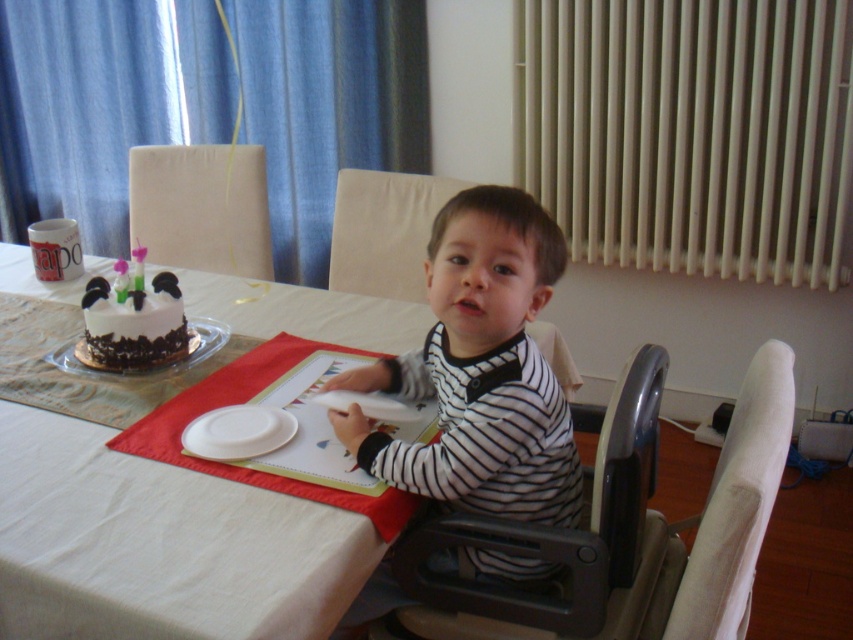
In the scene shown: Between striped fabric shirt at center and white chocolate cake at left, which one has less height?

white chocolate cake at left is shorter.

Can you confirm if striped fabric shirt at center is smaller than white chocolate cake at left?

No, striped fabric shirt at center is not smaller than white chocolate cake at left.

Where is `striped fabric shirt at center`? striped fabric shirt at center is located at coordinates (479, 371).

Is beige fabric chair at upper left shorter than white frosted cake at left?

No, beige fabric chair at upper left is not shorter than white frosted cake at left.

I want to click on beige fabric chair at upper left, so click(201, 208).

Does white frosted cake at left have a smaller size compared to white chocolate cake at left?

Actually, white frosted cake at left might be larger than white chocolate cake at left.

Is white frosted cake at left thinner than white chocolate cake at left?

In fact, white frosted cake at left might be wider than white chocolate cake at left.

Image resolution: width=853 pixels, height=640 pixels. Describe the element at coordinates (136, 326) in the screenshot. I see `white frosted cake at left` at that location.

This screenshot has height=640, width=853. Find the location of `white frosted cake at left`. white frosted cake at left is located at coordinates (136, 326).